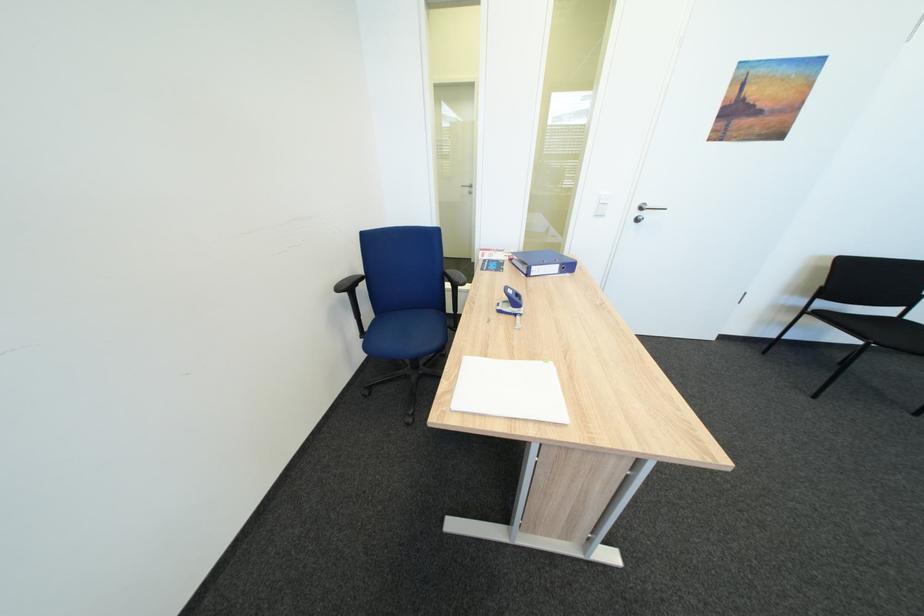
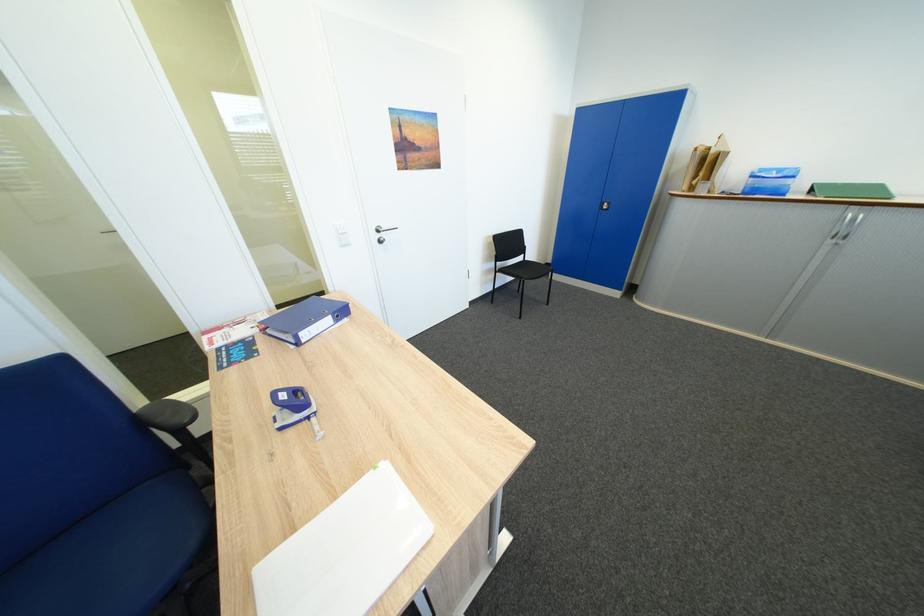
In the second image, find the point that corresponds to pixel 463 278 in the first image.

(169, 421)